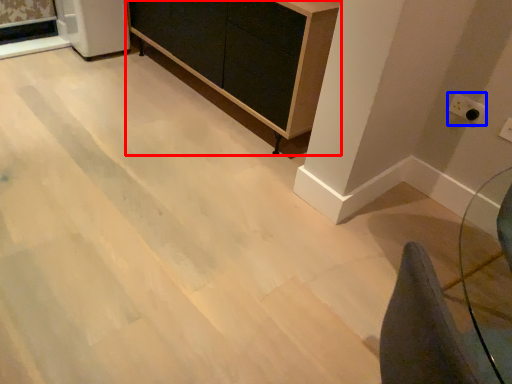
Question: Which object is further to the camera taking this photo, furniture (highlighted by a red box) or electric outlet (highlighted by a blue box)?

Choices:
 (A) furniture
 (B) electric outlet

Answer: (B)